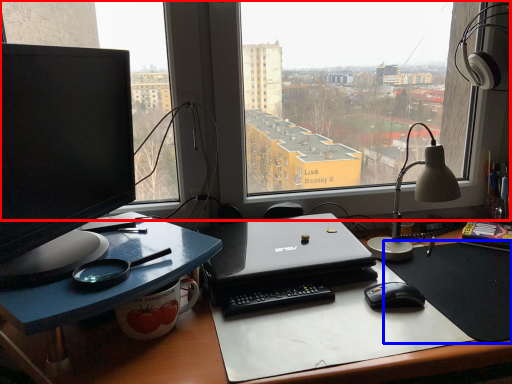
Question: Which point is closer to the camera, window (highlighted by a red box) or mousepad (highlighted by a blue box)?

Choices:
 (A) window
 (B) mousepad

Answer: (B)